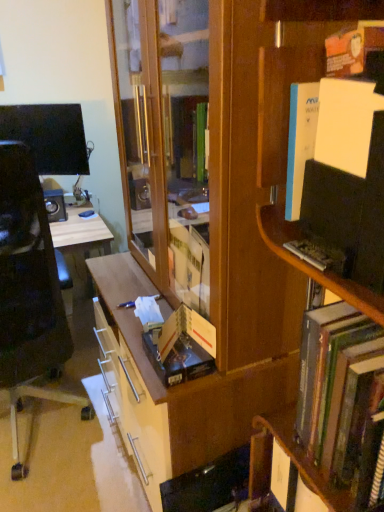
Question: From the image's perspective, does black plastic chair at left appear lower than wooden bookcase at center?

Choices:
 (A) no
 (B) yes

Answer: (B)

Question: Is black plastic chair at left to the left of wooden bookcase at center from the viewer's perspective?

Choices:
 (A) yes
 (B) no

Answer: (A)

Question: Is black plastic chair at left wider than wooden bookcase at center?

Choices:
 (A) yes
 (B) no

Answer: (A)

Question: From a real-world perspective, is black plastic chair at left on top of wooden bookcase at center?

Choices:
 (A) yes
 (B) no

Answer: (B)

Question: Is black plastic chair at left closer to camera compared to wooden bookcase at center?

Choices:
 (A) no
 (B) yes

Answer: (A)

Question: Looking at the image, does hardcover book at right seem bigger or smaller compared to wooden bookcase at center?

Choices:
 (A) small
 (B) big

Answer: (A)

Question: Is hardcover book at right to the left or to the right of wooden bookcase at center in the image?

Choices:
 (A) right
 (B) left

Answer: (A)

Question: In terms of height, does hardcover book at right look taller or shorter compared to wooden bookcase at center?

Choices:
 (A) tall
 (B) short

Answer: (B)

Question: Would you say hardcover book at right is inside or outside wooden bookcase at center?

Choices:
 (A) inside
 (B) outside

Answer: (B)

Question: Based on their positions, is black plastic chair at left located to the left or right of wooden bookcase at center?

Choices:
 (A) left
 (B) right

Answer: (A)

Question: From their relative heights in the image, would you say black plastic chair at left is taller or shorter than wooden bookcase at center?

Choices:
 (A) short
 (B) tall

Answer: (A)

Question: Considering the positions of black plastic chair at left and wooden bookcase at center in the image, is black plastic chair at left bigger or smaller than wooden bookcase at center?

Choices:
 (A) big
 (B) small

Answer: (B)

Question: From the image's perspective, is black plastic chair at left above or below wooden bookcase at center?

Choices:
 (A) below
 (B) above

Answer: (A)

Question: Is wooden bookcase at center to the left or to the right of wooden bookshelf at right in the image?

Choices:
 (A) right
 (B) left

Answer: (B)

Question: From a real-world perspective, relative to wooden bookshelf at right, is wooden bookcase at center vertically above or below?

Choices:
 (A) below
 (B) above

Answer: (A)